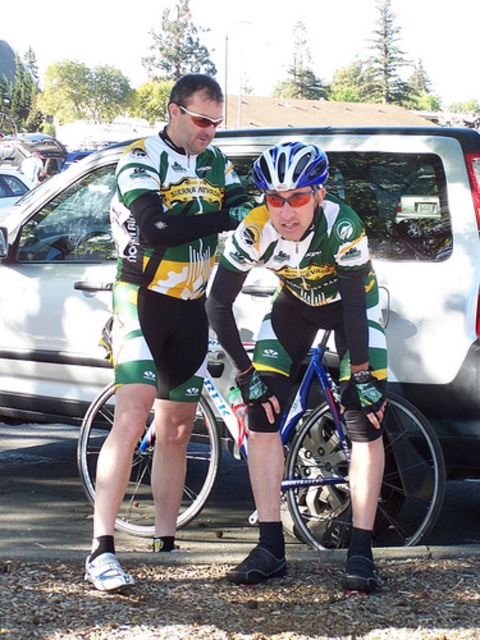
You are a photographer trying to capture a clear shot of both the green jersey at center and the blue glossy bicycle helmet at center. Since you want both subjects in focus, which one should you adjust your camera to prioritize focusing on first?

The green jersey at center is closer to the viewer than the blue glossy bicycle helmet at center, so you should focus on the green jersey at center first to ensure both are in focus.

You are a photographer planning to take a group photo of the cyclists. You need to ensure that both the green jersey at center and the blue glossy bicycle helmet at center are visible in the frame. Given their sizes, which object will require more space horizontally in the photo?

The green jersey at center requires more horizontal space in the photo because its width surpasses that of the blue glossy bicycle helmet at center.